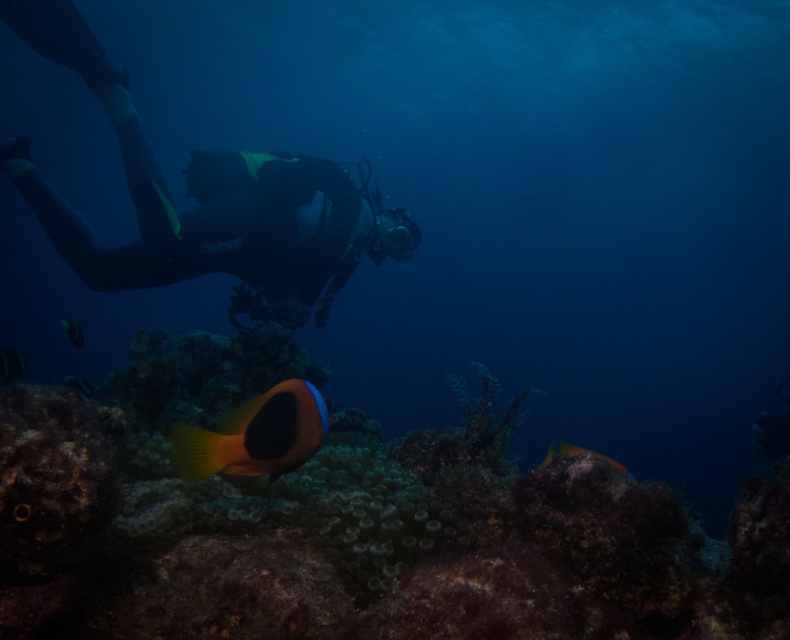
From the picture: Between orange matte fish at center and orange-yellow coral at center, which one has less height?

With less height is orange matte fish at center.

Based on the photo, does orange matte fish at center have a greater height compared to orange-yellow coral at center?

Incorrect, orange matte fish at center's height is not larger of orange-yellow coral at center's.

Is point (283, 394) farther from viewer compared to point (615, 467)?

No.

This screenshot has width=790, height=640. Identify the location of orange matte fish at center. (256, 435).

Which is above, orange matte fish at center or orange matte fish at lower center?

orange matte fish at lower center is above.

Image resolution: width=790 pixels, height=640 pixels. What do you see at coordinates (256, 435) in the screenshot? I see `orange matte fish at center` at bounding box center [256, 435].

Which is behind, point (307, 388) or point (74, 342)?

The point (74, 342) is behind.

I want to click on orange matte fish at center, so click(256, 435).

Can you confirm if translucent green coral reef at center is positioned below orange-yellow coral at center?

No, translucent green coral reef at center is not below orange-yellow coral at center.

Identify the location of translucent green coral reef at center. This screenshot has width=790, height=640. (348, 524).